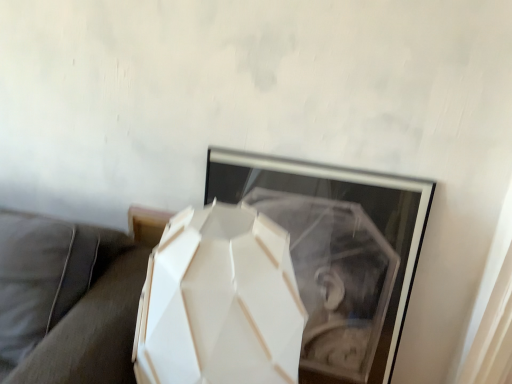
Question: Visually, is white matte geometric lamp at center positioned to the left or to the right of suede gray couch at lower left?

Choices:
 (A) left
 (B) right

Answer: (B)

Question: Does point (169, 360) appear closer or farther from the camera than point (4, 329)?

Choices:
 (A) closer
 (B) farther

Answer: (A)

Question: Considering the positions of white matte geometric lamp at center and suede gray couch at lower left in the image, is white matte geometric lamp at center taller or shorter than suede gray couch at lower left?

Choices:
 (A) tall
 (B) short

Answer: (A)

Question: From a real-world perspective, is suede gray couch at lower left physically located above or below white matte geometric lamp at center?

Choices:
 (A) above
 (B) below

Answer: (B)

Question: Considering the positions of suede gray couch at lower left and white matte geometric lamp at center in the image, is suede gray couch at lower left bigger or smaller than white matte geometric lamp at center?

Choices:
 (A) small
 (B) big

Answer: (B)

Question: In the image, is suede gray couch at lower left on the left side or the right side of white matte geometric lamp at center?

Choices:
 (A) left
 (B) right

Answer: (A)

Question: From their relative heights in the image, would you say suede gray couch at lower left is taller or shorter than white matte geometric lamp at center?

Choices:
 (A) tall
 (B) short

Answer: (B)